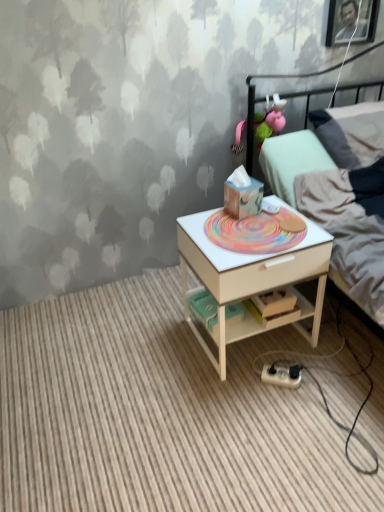
Locate an element on the screen. The height and width of the screenshot is (512, 384). vacant area that lies in front of white wood desk at center is located at coordinates (264, 413).